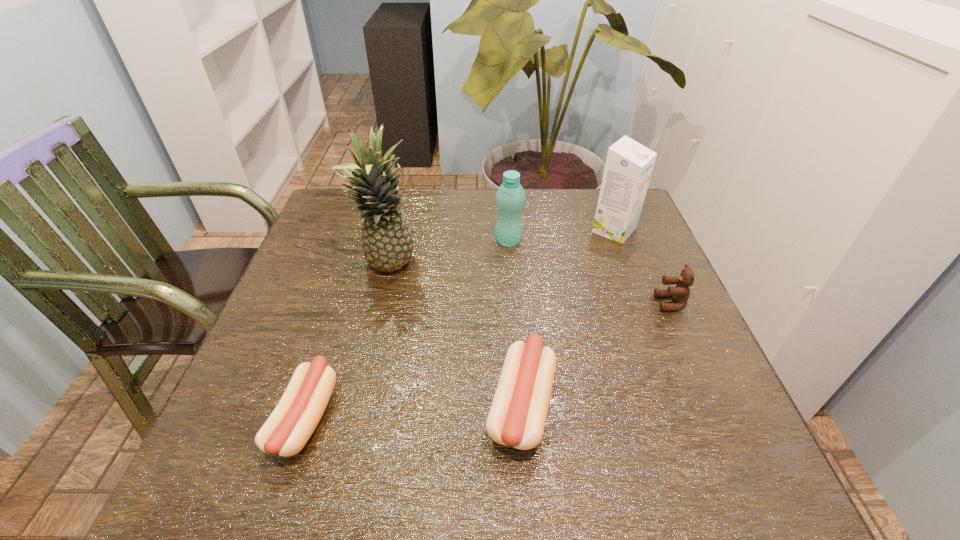
The height and width of the screenshot is (540, 960). I want to click on vacant space located 0.290m on the left of the right sausage, so click(325, 404).

Image resolution: width=960 pixels, height=540 pixels. What are the coordinates of `vacant space located on the left of the carton` in the screenshot? It's located at (459, 231).

The height and width of the screenshot is (540, 960). I want to click on vacant region located on the left of the pineapple, so click(x=307, y=267).

Find the location of a particular element. The width and height of the screenshot is (960, 540). vacant region located on the right of the fourth shortest object is located at coordinates (588, 241).

Locate an element on the screen. The height and width of the screenshot is (540, 960). free space located on the face of the teddy bear is located at coordinates click(483, 303).

Locate an element on the screen. This screenshot has height=540, width=960. blank space located on the face of the teddy bear is located at coordinates (576, 303).

In order to click on vacant space situated 0.260m on the face of the teddy bear in this screenshot , I will do `click(540, 303)`.

At what (x,y) coordinates should I click in order to perform the action: click on carton present at the far edge. Please return your answer as a coordinate pair (x, y). The height and width of the screenshot is (540, 960). Looking at the image, I should click on (629, 165).

Where is `bottle that is at the far edge`? bottle that is at the far edge is located at coordinates (510, 197).

Locate an element on the screen. The height and width of the screenshot is (540, 960). sausage that is at the left edge is located at coordinates (297, 414).